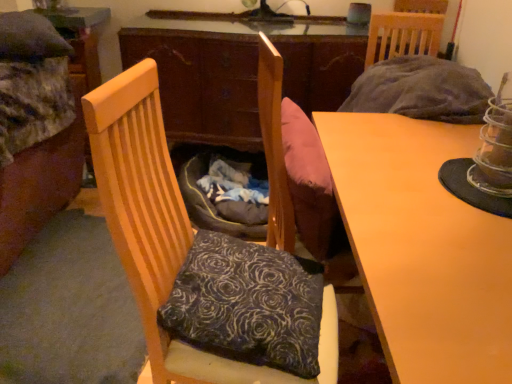
Question: Does matte wood desk at center have a greater height compared to velvet floral pillow at center?

Choices:
 (A) yes
 (B) no

Answer: (A)

Question: Considering the relative sizes of matte wood desk at center and velvet floral pillow at center in the image provided, is matte wood desk at center smaller than velvet floral pillow at center?

Choices:
 (A) no
 (B) yes

Answer: (A)

Question: Does matte wood desk at center have a lesser height compared to velvet floral pillow at center?

Choices:
 (A) no
 (B) yes

Answer: (A)

Question: From a real-world perspective, is matte wood desk at center beneath velvet floral pillow at center?

Choices:
 (A) yes
 (B) no

Answer: (A)

Question: Is matte wood desk at center oriented towards velvet floral pillow at center?

Choices:
 (A) yes
 (B) no

Answer: (A)

Question: In terms of width, does wooden chair at left look wider or thinner when compared to velvet floral pillow at center?

Choices:
 (A) wide
 (B) thin

Answer: (A)

Question: From the image's perspective, is wooden chair at left positioned above or below velvet floral pillow at center?

Choices:
 (A) below
 (B) above

Answer: (B)

Question: Is wooden chair at left in front of or behind velvet floral pillow at center in the image?

Choices:
 (A) behind
 (B) front

Answer: (B)

Question: Would you say wooden chair at left is to the left or to the right of velvet floral pillow at center in the picture?

Choices:
 (A) right
 (B) left

Answer: (B)

Question: Is velvet floral pillow at center wider or thinner than velvet fabric bed at left?

Choices:
 (A) thin
 (B) wide

Answer: (A)

Question: Considering the positions of point (181, 324) and point (0, 248), is point (181, 324) closer or farther from the camera than point (0, 248)?

Choices:
 (A) farther
 (B) closer

Answer: (B)

Question: From the image's perspective, is velvet floral pillow at center positioned above or below velvet fabric bed at left?

Choices:
 (A) below
 (B) above

Answer: (A)

Question: Visually, is velvet floral pillow at center positioned to the left or to the right of velvet fabric bed at left?

Choices:
 (A) left
 (B) right

Answer: (B)

Question: Is point pos(159,193) positioned closer to the camera than point pos(397,307)?

Choices:
 (A) closer
 (B) farther

Answer: (B)

Question: Considering the relative positions of wooden chair at left and matte wood desk at center in the image provided, is wooden chair at left to the left or to the right of matte wood desk at center?

Choices:
 (A) right
 (B) left

Answer: (B)